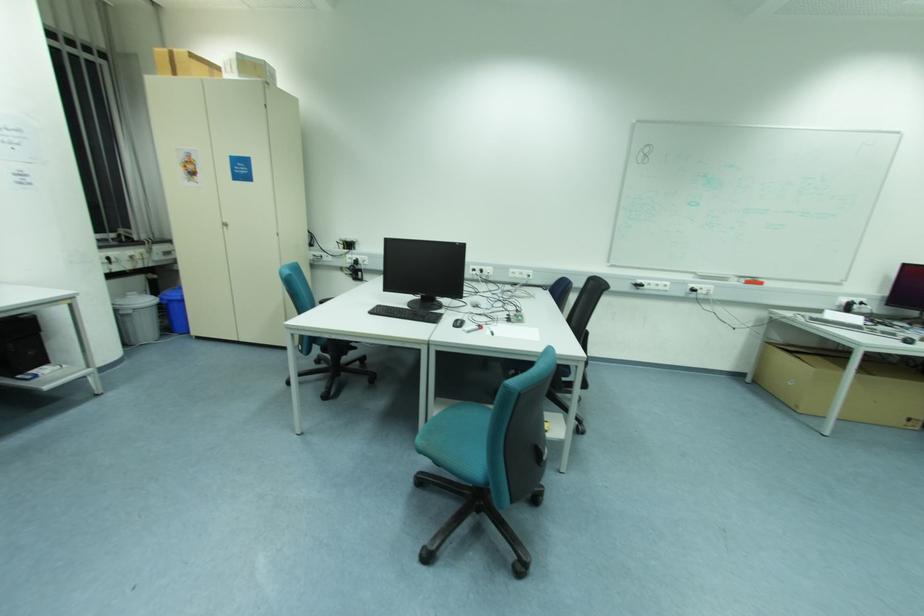
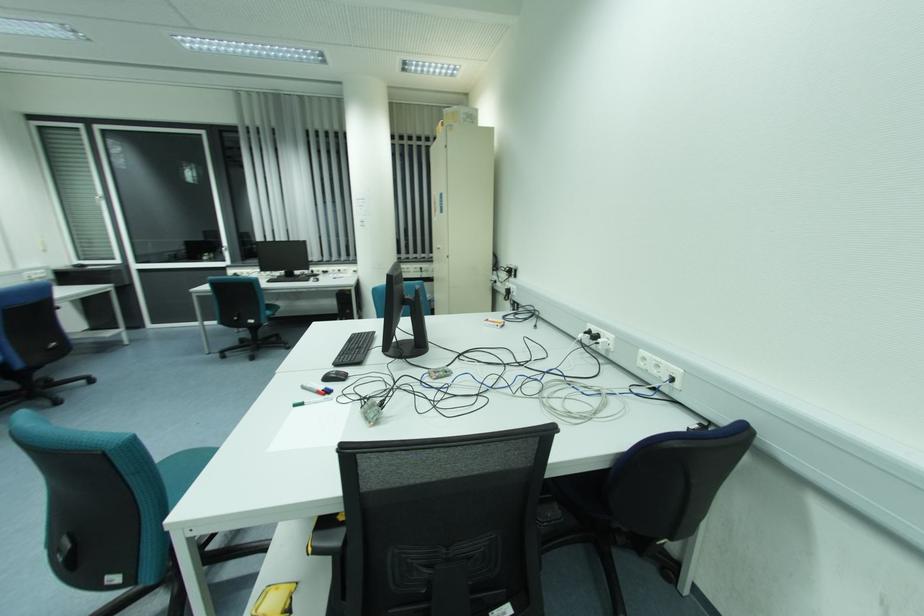
The point at (490, 270) is marked in the first image. Where is the corresponding point in the second image?

(608, 339)